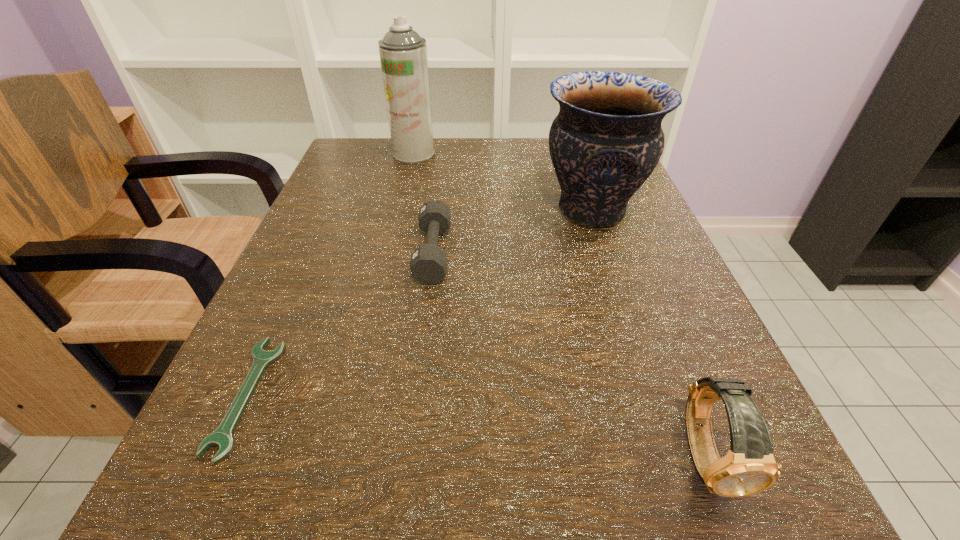
This screenshot has width=960, height=540. I want to click on object that is the fourth nearest to the third shortest object, so click(x=403, y=53).

Where is `object that stands as the third closest to the shortest object`? The height and width of the screenshot is (540, 960). object that stands as the third closest to the shortest object is located at coordinates (749, 467).

Image resolution: width=960 pixels, height=540 pixels. Identify the location of blank area in the image that satisfies the following two spatial constraints: 1. on the back side of the dumbbell; 2. on the left side of the leftmost object. (311, 252).

Find the location of a particular element. The width and height of the screenshot is (960, 540). vacant space that satisfies the following two spatial constraints: 1. on the front handle of the second tallest object; 2. on the front side of the shortest object is located at coordinates (654, 395).